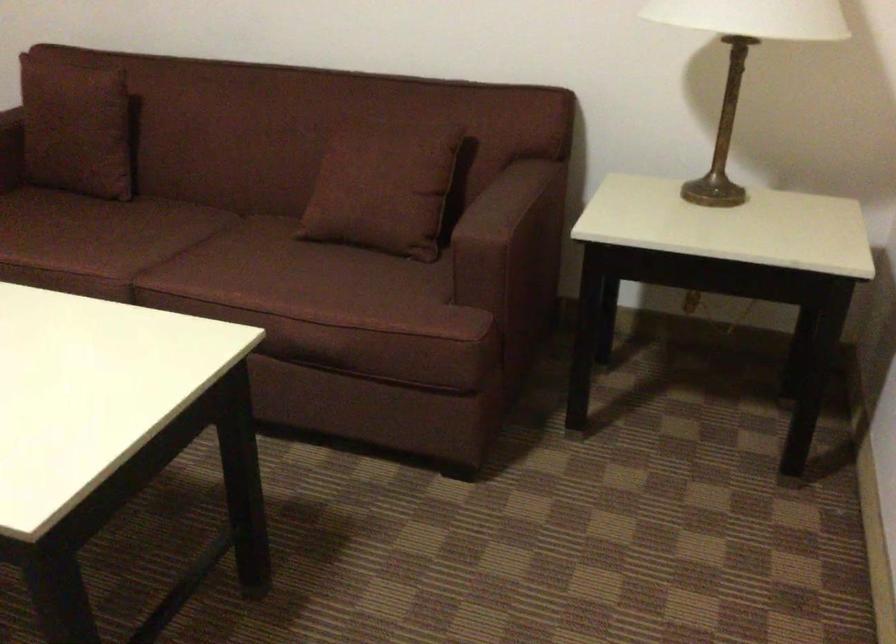
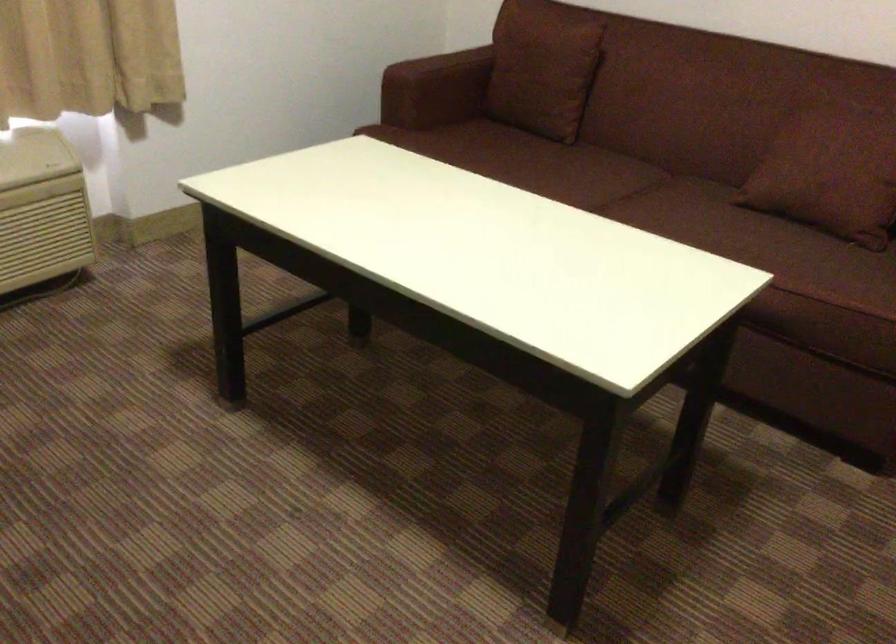
In the second image, find the point that corresponds to [389,232] in the first image.

(842, 207)